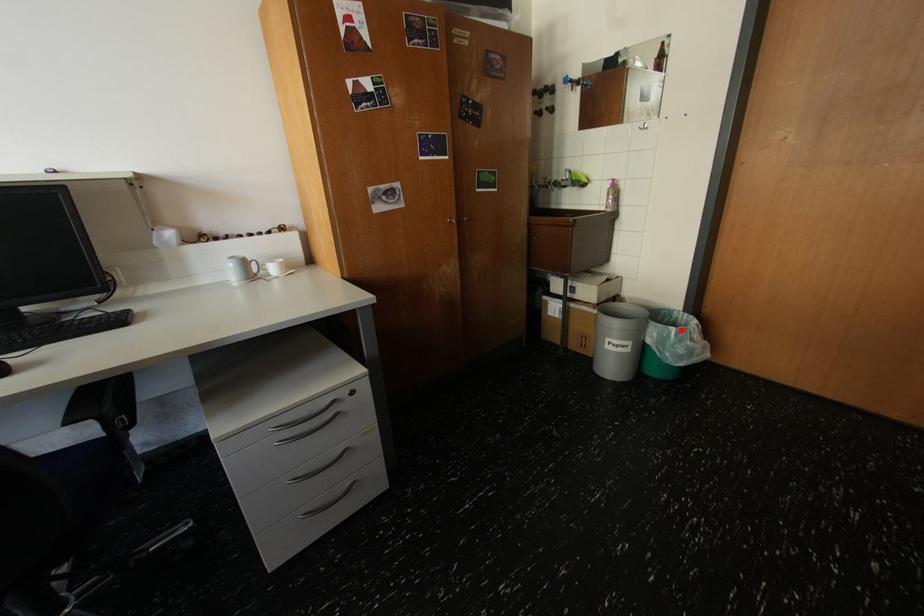
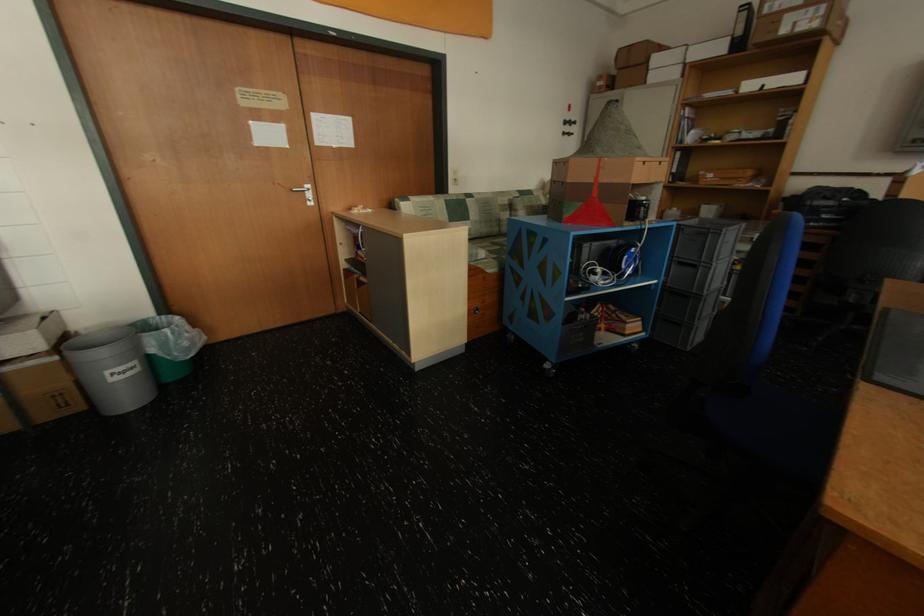
In the second image, find the point that corresponds to the highlighted location in the first image.

(176, 331)